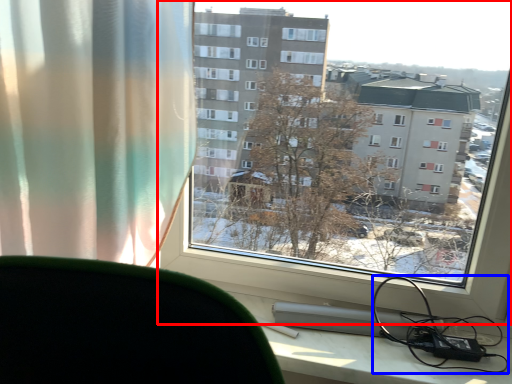
Question: Which point is further to the camera, window (highlighted by a red box) or cable (highlighted by a blue box)?

Choices:
 (A) window
 (B) cable

Answer: (B)